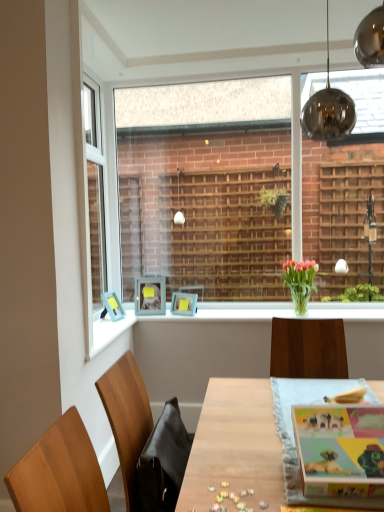
This screenshot has width=384, height=512. I want to click on blank space situated above wooden table at center (from a real-world perspective), so click(x=273, y=415).